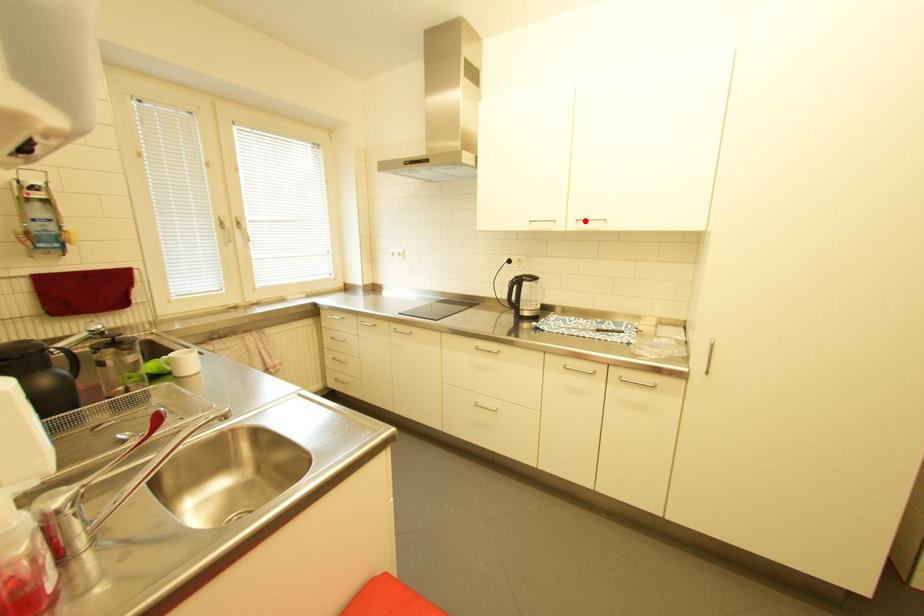
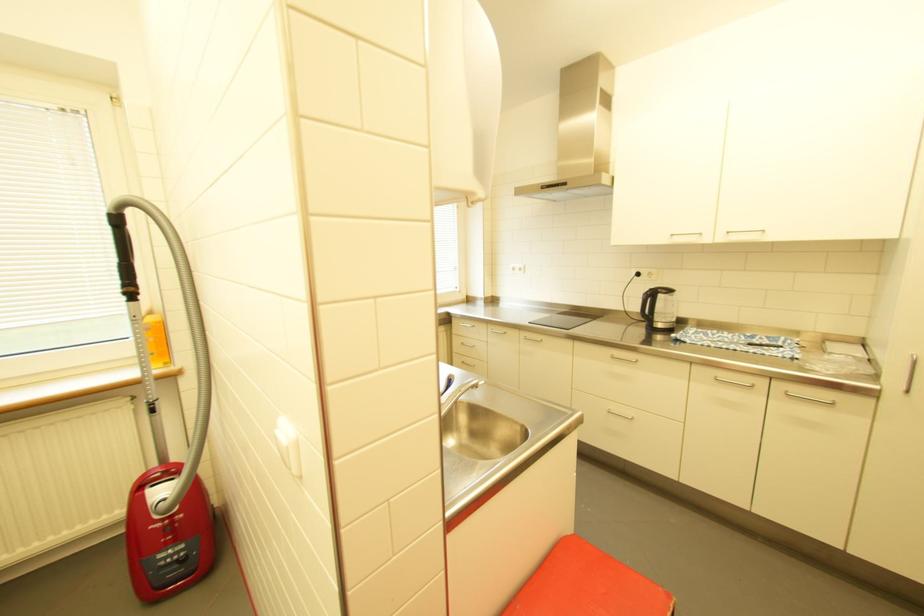
Where in the second image is the point corresponding to the highlighted location from the first image?

(736, 233)